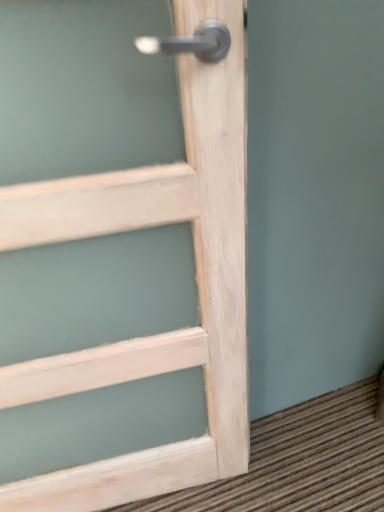
What do you see at coordinates (196, 280) in the screenshot? I see `natural wood door at center` at bounding box center [196, 280].

Locate an element on the screen. natural wood door at center is located at coordinates (196, 280).

I want to click on natural wood door at center, so click(196, 280).